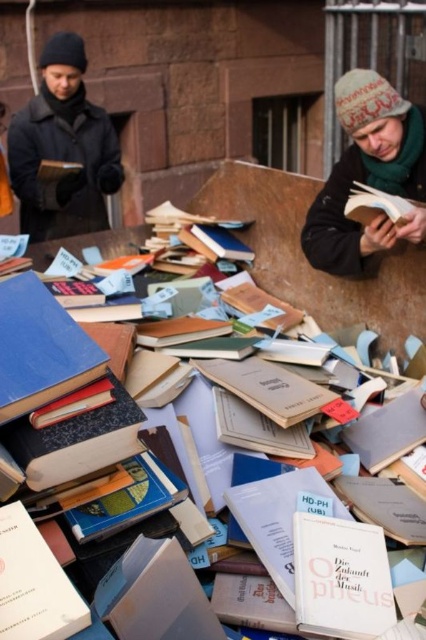
You are a delivery person who needs to place a new book between the hardcover book at lower left and the hardcover book at center. The new book is 1.5 feet wide. Is there enough space between them to fit the new book?

The hardcover book at lower left is 5.21 feet from the hardcover book at center, so yes, there is enough space to fit the new book which is 1.5 feet wide between them.

You are a customer at a book sale and want to pick up the knitted wool hat at upper right and the hardcover book at center. Which item will you need to reach over first?

You will need to reach over the knitted wool hat at upper right first because it is closer to you than the hardcover book at center.